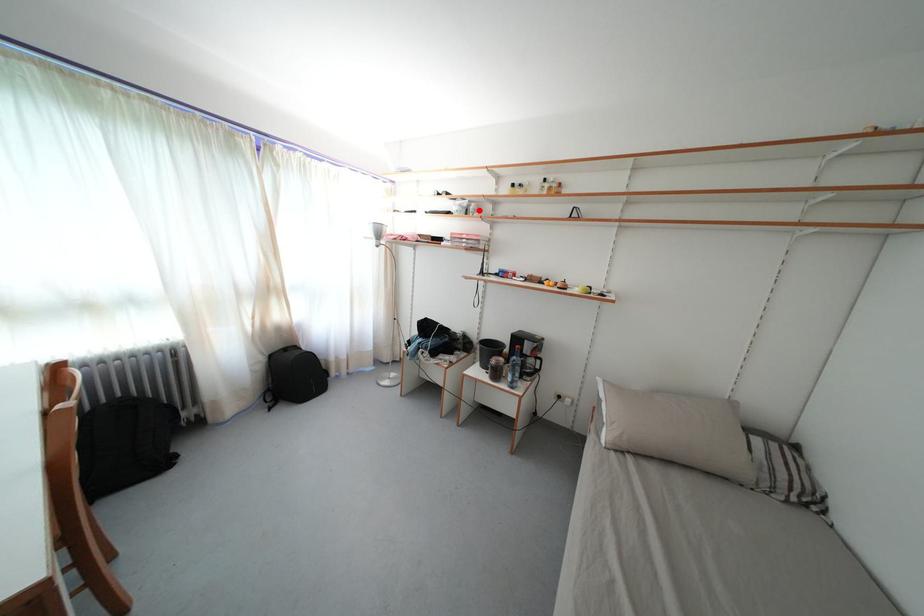
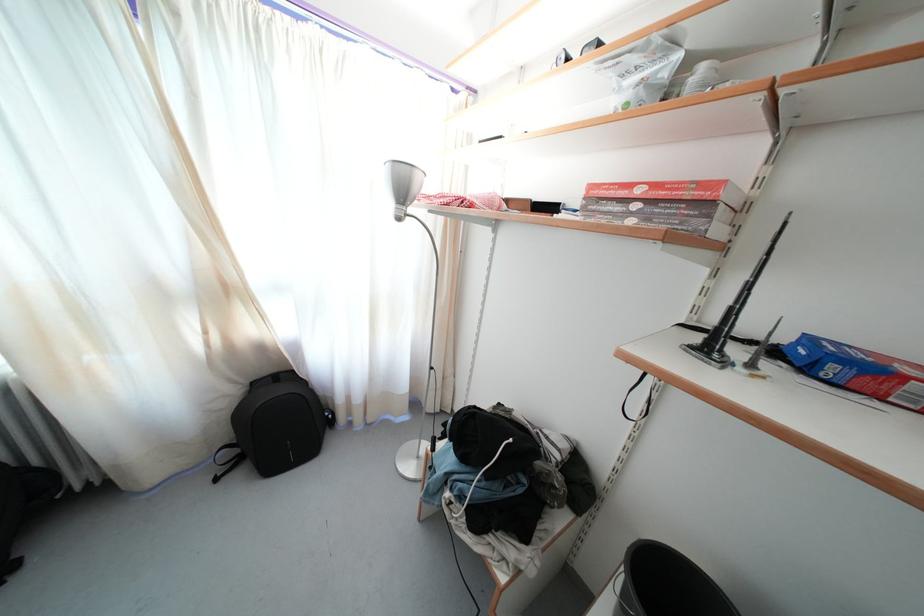
Where in the second image is the point corresponding to the highlighted location from the first image?

(709, 73)